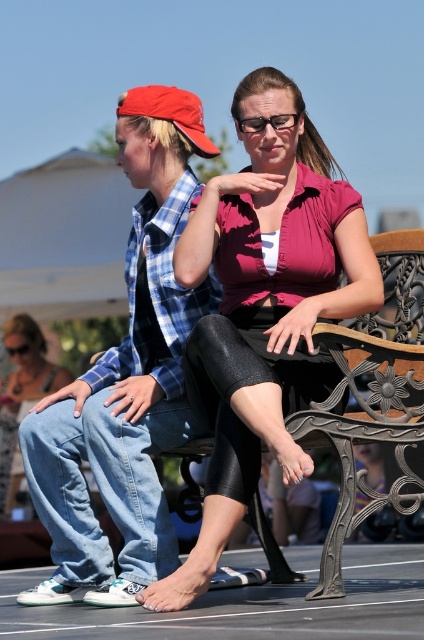
Is point (242, 381) closer to viewer compared to point (33, 467)?

Yes, it is.

Is matte pink blouse at center taller than denim jeans at left?

Incorrect, matte pink blouse at center's height is not larger of denim jeans at left's.

Is point (217, 556) positioned behind point (170, 211)?

No.

Identify the location of matte pink blouse at center. (264, 307).

Between matte pink blouse at center and denim pants at left, which one has more height?

matte pink blouse at center

Is the position of matte pink blouse at center less distant than that of denim pants at left?

Yes.

This screenshot has width=424, height=640. I want to click on matte pink blouse at center, so click(264, 307).

Which is behind, point (148, 259) or point (10, 385)?

The point (10, 385) is more distant.

Who is taller, denim jeans at left or denim pants at left?

denim jeans at left is taller.

You are a GUI agent. You are given a task and a screenshot of the screen. Output one action in this format:
    pyautogui.click(x=<x>, y=<y>)
    Task: Click on the denim jeans at left
    
    Given the screenshot: What is the action you would take?
    pyautogui.click(x=125, y=378)